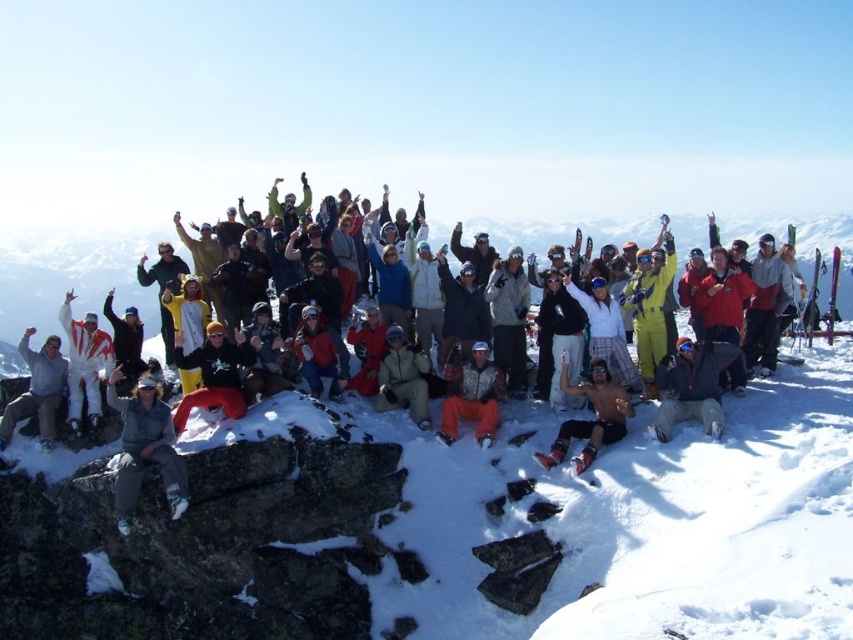
Question: Which object is closer to the camera taking this photo?

Choices:
 (A) matte gray jacket at lower left
 (B) white matte snowsuit at left

Answer: (A)

Question: Which of these objects is positioned closest to the camouflage pants at center?

Choices:
 (A) matte black jacket at center
 (B) khaki fabric jacket at center
 (C) white matte snowsuit at left

Answer: (B)

Question: Which object is the farthest from the shiny metallic helmet at center?

Choices:
 (A) camouflage pants at center
 (B) matte black jacket at center
 (C) gray fleece jacket at lower left

Answer: (C)

Question: Is matte black jacket at center closer to the viewer compared to camouflage pants at center?

Choices:
 (A) no
 (B) yes

Answer: (A)

Question: Is white fluffy snow at center positioned before shiny metallic helmet at center?

Choices:
 (A) no
 (B) yes

Answer: (B)

Question: Can you confirm if camouflage pants at center is thinner than white matte snowsuit at left?

Choices:
 (A) yes
 (B) no

Answer: (A)